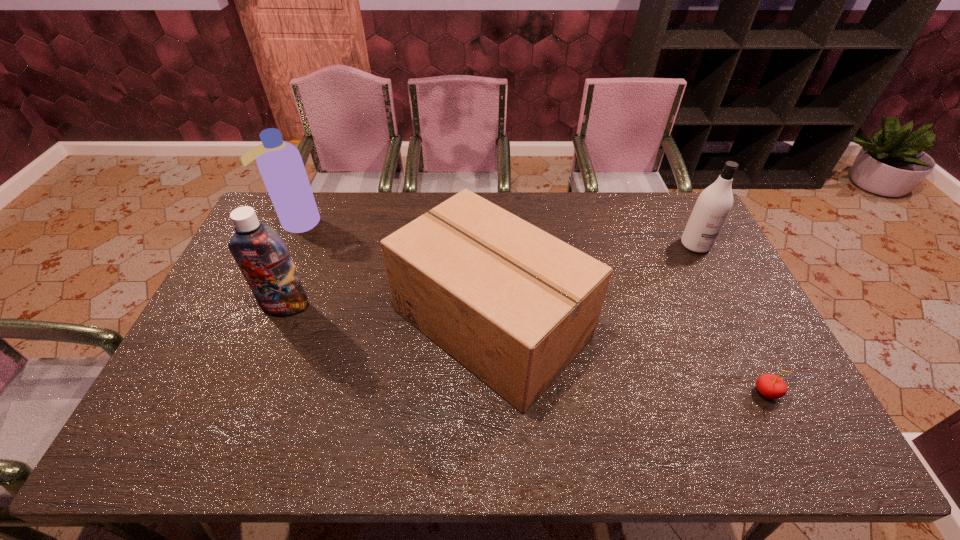
At what (x,y) coordinates should I click in order to perform the action: click on free space between the third object from right to left and the cherry. Please return your answer as a coordinate pair (x, y). This screenshot has height=540, width=960. Looking at the image, I should click on (629, 358).

Find the location of a particular element. The height and width of the screenshot is (540, 960). unoccupied position between the cherry and the third object from right to left is located at coordinates (629, 358).

Locate an element on the screen. This screenshot has width=960, height=540. the closest object to the cherry is located at coordinates (513, 304).

Locate an element on the screen. object that is the second closest one to the rightmost shampoo is located at coordinates (771, 386).

Locate an element on the screen. The width and height of the screenshot is (960, 540). shampoo that stands as the closest to the shortest object is located at coordinates pyautogui.click(x=714, y=204).

I want to click on shampoo object that ranks as the second closest to the box, so click(x=280, y=164).